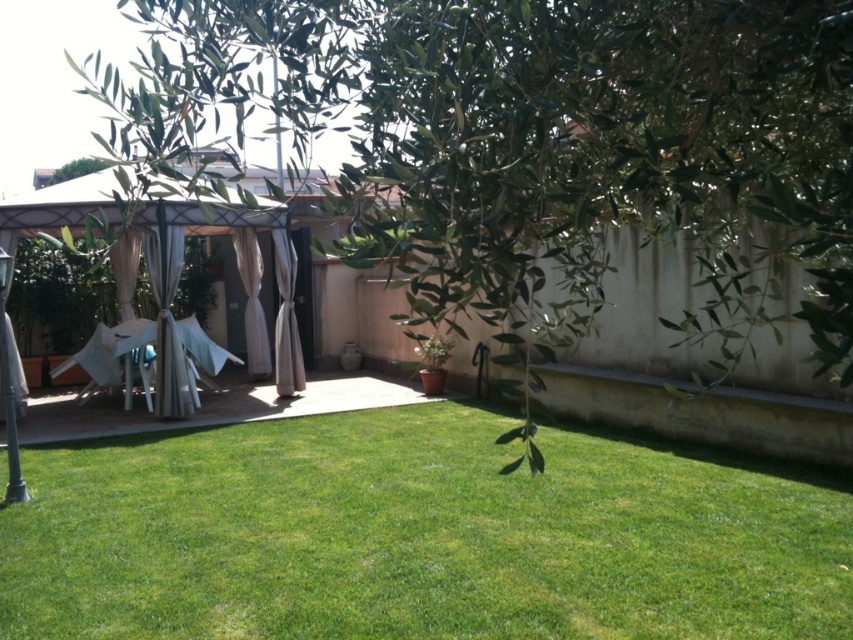
Does green leafy tree at upper center appear on the left side of green grass at center?

In fact, green leafy tree at upper center is to the right of green grass at center.

Is point (483, 272) more distant than point (207, 577)?

That is False.

Is point (422, 80) behind point (225, 563)?

No.

The height and width of the screenshot is (640, 853). What are the coordinates of `green leafy tree at upper center` in the screenshot? It's located at (543, 150).